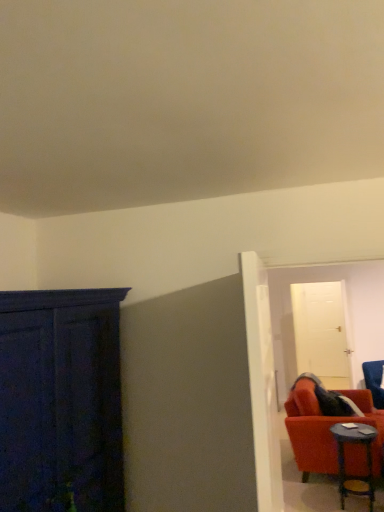
Question: Does velvet blue armchair at right have a smaller size compared to wooden round table at lower right?

Choices:
 (A) yes
 (B) no

Answer: (B)

Question: Is velvet blue armchair at right placed right next to wooden round table at lower right?

Choices:
 (A) no
 (B) yes

Answer: (A)

Question: Does velvet blue armchair at right have a lesser width compared to wooden round table at lower right?

Choices:
 (A) no
 (B) yes

Answer: (A)

Question: From the image's perspective, is velvet blue armchair at right on top of wooden round table at lower right?

Choices:
 (A) no
 (B) yes

Answer: (A)

Question: Does velvet blue armchair at right lie in front of wooden round table at lower right?

Choices:
 (A) no
 (B) yes

Answer: (A)

Question: Considering their positions, is wooden round table at lower right located in front of or behind velvet blue armchair at right?

Choices:
 (A) behind
 (B) front

Answer: (B)

Question: From the image's perspective, relative to velvet blue armchair at right, is wooden round table at lower right above or below?

Choices:
 (A) above
 (B) below

Answer: (A)

Question: Is wooden round table at lower right wider or thinner than velvet blue armchair at right?

Choices:
 (A) thin
 (B) wide

Answer: (A)

Question: Which is correct: wooden round table at lower right is inside velvet blue armchair at right, or outside of it?

Choices:
 (A) inside
 (B) outside

Answer: (B)

Question: Visually, is white glossy door at center, the second door in the right-to-left sequence, positioned to the left or to the right of wooden round table at lower right?

Choices:
 (A) left
 (B) right

Answer: (A)

Question: Looking at their shapes, would you say white glossy door at center, acting as the first door starting from the front, is wider or thinner than wooden round table at lower right?

Choices:
 (A) wide
 (B) thin

Answer: (B)

Question: Considering the positions of white glossy door at center, acting as the first door starting from the front, and wooden round table at lower right in the image, is white glossy door at center, acting as the first door starting from the front, taller or shorter than wooden round table at lower right?

Choices:
 (A) short
 (B) tall

Answer: (B)

Question: From a real-world perspective, is white glossy door at center, the second door when ordered from back to front, physically located above or below wooden round table at lower right?

Choices:
 (A) above
 (B) below

Answer: (A)

Question: From the image's perspective, is white glossy door at upper right, which ranks as the 1th door in back-to-front order, located above or below velvet blue armchair at right?

Choices:
 (A) below
 (B) above

Answer: (B)

Question: Looking at the image, does white glossy door at upper right, which ranks as the 1th door in back-to-front order, seem bigger or smaller compared to velvet blue armchair at right?

Choices:
 (A) big
 (B) small

Answer: (B)